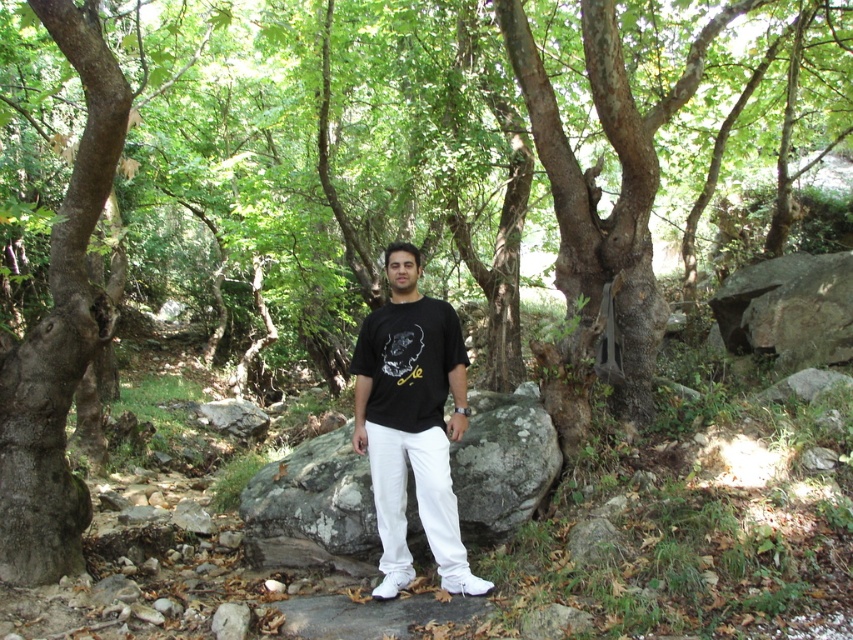
Which is in front, point (496, 420) or point (431, 509)?

Positioned in front is point (431, 509).

Between gray rough boulder at center and black matte t-shirt at center, which one has less height?

With less height is gray rough boulder at center.

Does point (308, 492) come closer to viewer compared to point (401, 508)?

No, (308, 492) is further to viewer.

Locate an element on the screen. This screenshot has height=640, width=853. gray rough boulder at center is located at coordinates (312, 508).